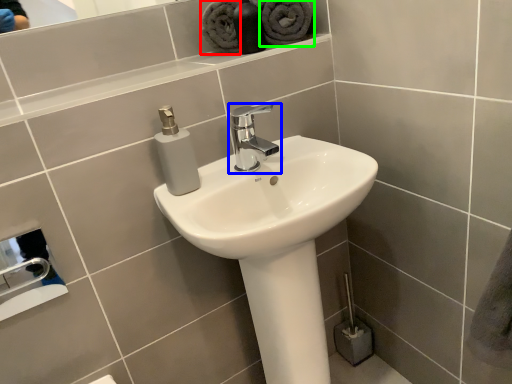
Question: Estimate the real-world distances between objects in this image. Which object is farther from bath towel (highlighted by a red box), tap (highlighted by a blue box) or bath towel (highlighted by a green box)?

Choices:
 (A) tap
 (B) bath towel

Answer: (A)